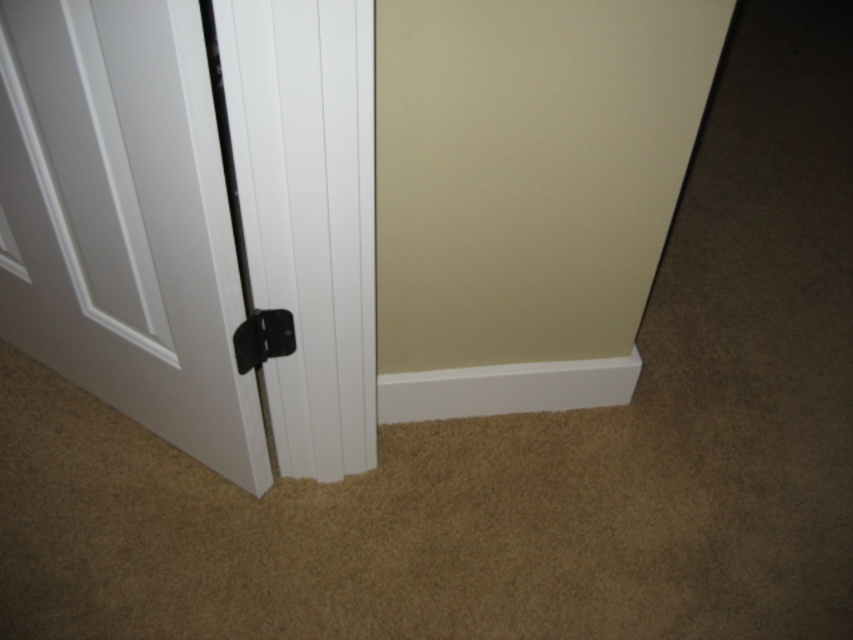
You are a painter who needs to apply a new coat of paint to the white matte door at lower left and the black plastic door handle at center. If you have a paintbrush that is 12 cm long, can you use it to paint both objects without needing a longer brush?

The white matte door at lower left might be wider than the black plastic door handle at center, so the door could require a longer brush. However, the description does not specify the exact width of the door or the handle. Without knowing their exact dimensions, it is uncertain if the 12 cm brush is sufficient for both. You may need to measure them first.

You are standing in a room and see a white door at lower left. You want to place a small hook exactly at point [123,220] on the door. Is this point located on the door?

The point [123,220] corresponds to the white matte door at lower left, so yes, the point is located on the door.

You are standing in front of the white door and want to determine which of the two points, point (x=167, y=420) or point (x=289, y=314), is closer to you. Based on the scene description, which point is nearer?

Point (x=167, y=420) is further to the viewer than point (x=289, y=314). Wait, the question asks which is closer to you. Since point (x=167, y=420) is further to the viewer, that means it is farther away from you. Therefore, point (x=289, y=314) is closer to you.